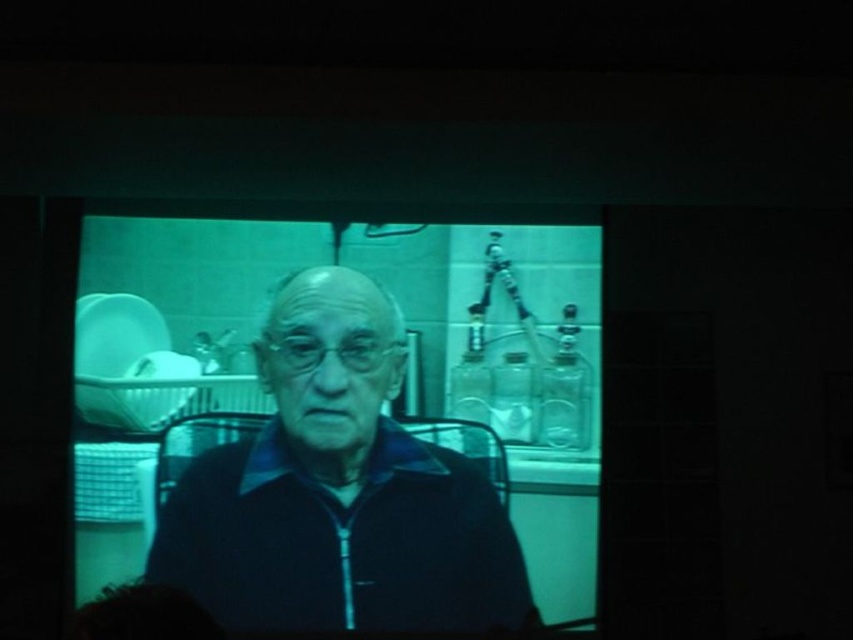
Question: Does dark blue zip-up jacket at center appear over dark hair at lower left?

Choices:
 (A) no
 (B) yes

Answer: (A)

Question: In this image, where is dark blue zip-up jacket at center located relative to dark hair at lower left?

Choices:
 (A) left
 (B) right

Answer: (B)

Question: Is dark blue zip-up jacket at center below dark hair at lower left?

Choices:
 (A) yes
 (B) no

Answer: (A)

Question: Which point is farther to the camera?

Choices:
 (A) dark blue zip-up jacket at center
 (B) dark hair at lower left

Answer: (A)